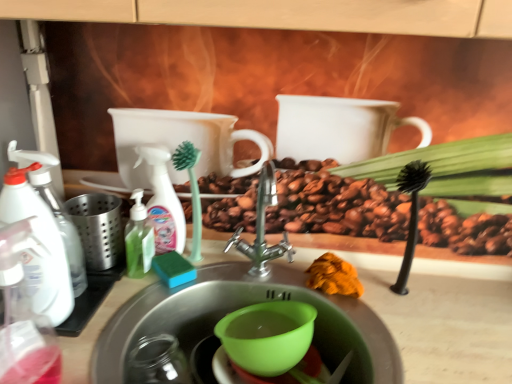
You are a GUI agent. You are given a task and a screenshot of the screen. Output one action in this format:
    pyautogui.click(x=<x>, y=<y>)
    Task: Click on the free space in front of green plastic scrub brush at center, the second plant from the right
    The height and width of the screenshot is (384, 512).
    Given the screenshot: What is the action you would take?
    pyautogui.click(x=161, y=307)